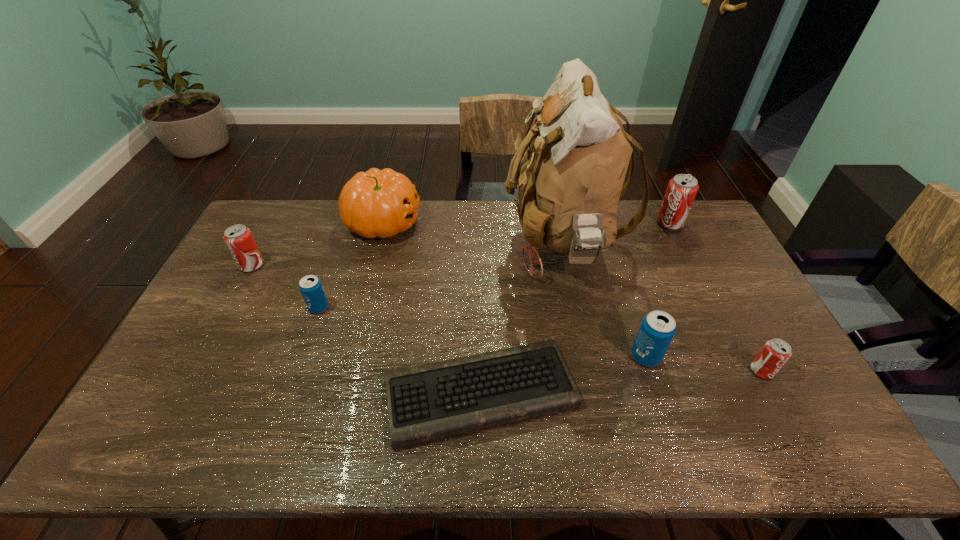
This screenshot has width=960, height=540. Identify the location of vacant space at the near edge. (660, 440).

I want to click on vacant space at the left edge of the desktop, so click(x=225, y=276).

Find the location of a particular element. Image resolution: width=960 pixels, height=540 pixels. free space at the right edge of the desktop is located at coordinates tap(704, 300).

Where is `free space between the leftmost pink soda can and the third soda can from left to right`? The width and height of the screenshot is (960, 540). free space between the leftmost pink soda can and the third soda can from left to right is located at coordinates (449, 311).

You are a GUI agent. You are given a task and a screenshot of the screen. Output one action in this format:
    pyautogui.click(x=<x>, y=<y>)
    Task: Click on the free point between the leftmost pink soda can and the nearest pink soda can
    The image size is (960, 540).
    Given the screenshot: What is the action you would take?
    pyautogui.click(x=507, y=318)

Where is `empty space between the shortest object and the biggest pink soda can`? Image resolution: width=960 pixels, height=540 pixels. empty space between the shortest object and the biggest pink soda can is located at coordinates (575, 308).

Image resolution: width=960 pixels, height=540 pixels. I want to click on vacant area between the nearest pink soda can and the second soda can from left to right, so click(540, 339).

Find the location of `free area in between the second nearest pink soda can and the biggest pink soda can`. free area in between the second nearest pink soda can and the biggest pink soda can is located at coordinates (461, 244).

Locate an element on the screen. unoccupied position between the fourth nearest object and the nearest pink soda can is located at coordinates (540, 339).

This screenshot has height=540, width=960. Find the location of `empty location between the second biggest pink soda can and the shortest object`. empty location between the second biggest pink soda can and the shortest object is located at coordinates (366, 329).